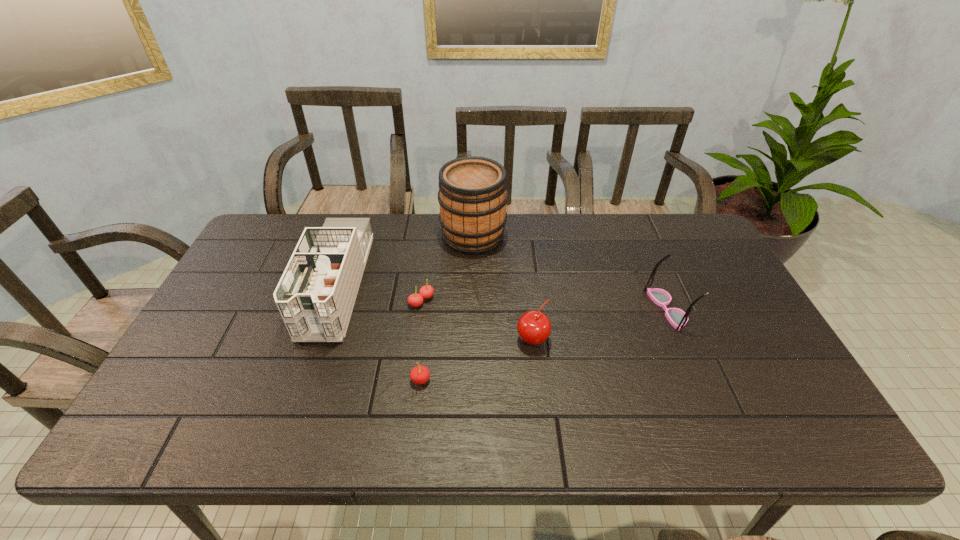
At what (x,y) coordinates should I click in order to perform the action: click on the shortest cherry. Please return your answer as a coordinate pair (x, y). Image resolution: width=960 pixels, height=540 pixels. Looking at the image, I should click on (426, 291).

At what (x,y) coordinates should I click in order to perform the action: click on blank space located 0.140m on the right of the cider. Please return your answer as a coordinate pair (x, y). The image size is (960, 540). Looking at the image, I should click on (547, 236).

You are a GUI agent. You are given a task and a screenshot of the screen. Output one action in this format:
    pyautogui.click(x=<x>, y=<y>)
    Task: Click on the free region located at the entrance of the second tallest object
    
    Given the screenshot: What is the action you would take?
    pyautogui.click(x=310, y=361)

Locate an element on the screen. free region located 0.060m on the left of the rightmost object is located at coordinates (628, 309).

You are a GUI agent. You are given a task and a screenshot of the screen. Output one action in this format:
    pyautogui.click(x=<x>, y=<y>)
    Task: Click on the vacant space located on the back of the fifth object from left to right
    Image resolution: width=960 pixels, height=540 pixels.
    Given the screenshot: What is the action you would take?
    pyautogui.click(x=525, y=273)

This screenshot has height=540, width=960. Identify the location of vacant space situated 0.370m on the back of the nearest object. (433, 271).

Locate an element on the screen. The image size is (960, 540). vacant space located 0.080m on the right of the shortest cherry is located at coordinates (462, 301).

In order to click on cider at the far edge in this screenshot , I will do `click(472, 194)`.

Find the location of `dollhouse present at the far edge`. dollhouse present at the far edge is located at coordinates (315, 296).

The width and height of the screenshot is (960, 540). Identify the location of free space at the near edge of the desktop. (483, 413).